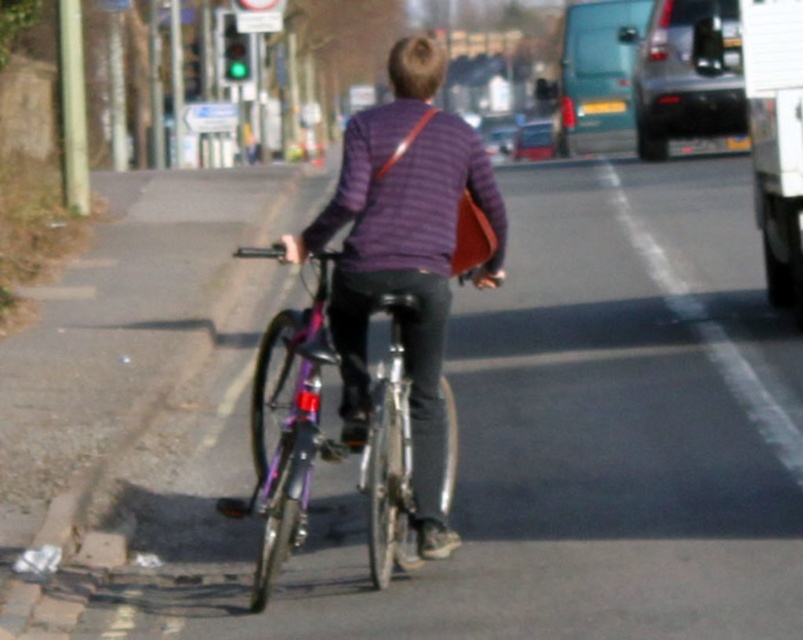
You are standing at the starting point and see the purple striped sweater at center. If you walk straight towards it, how far will you have to walk to reach it?

The purple striped sweater at center is 20.34 feet away from the viewer, so you will have to walk 20.34 feet to reach it.

Consider the image. You are a delivery person who needs to ensure your bicycle can fit through a narrow alleyway. Based on the image, which object takes up more space, the purple striped sweater at center or the shiny purple bicycle at center?

The shiny purple bicycle at center takes up more space than the purple striped sweater at center, so the bicycle would require more space to navigate the alleyway.

You are a pedestrian trying to cross the street safely. You see a person wearing a purple striped sweater at center and a shiny purple bicycle at center. Which object is shorter in height?

The purple striped sweater at center has a lesser height compared to the shiny purple bicycle at center, so the purple striped sweater at center is shorter.